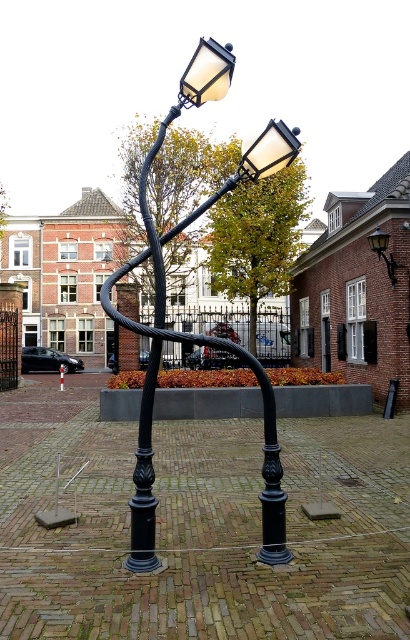
Question: Does black matte lamp post at center appear on the right side of matte black lamp at upper right?

Choices:
 (A) no
 (B) yes

Answer: (A)

Question: Can you confirm if matte glass streetlight at upper center is smaller than matte black lamp at upper right?

Choices:
 (A) no
 (B) yes

Answer: (A)

Question: Which object appears farthest from the camera in this image?

Choices:
 (A) matte glass streetlight at upper center
 (B) matte black lamp at upper right
 (C) black matte lamp post at center
 (D) matte black streetlight at upper center

Answer: (B)

Question: Which object appears farthest from the camera in this image?

Choices:
 (A) matte glass streetlight at upper center
 (B) matte black streetlight at upper center
 (C) black matte lamp post at center
 (D) matte black lamp at upper right

Answer: (D)

Question: Among these points, which one is nearest to the camera?

Choices:
 (A) (375, 243)
 (B) (273, 166)
 (C) (107, 280)
 (D) (218, 61)

Answer: (D)

Question: From the image, what is the correct spatial relationship of black matte lamp post at center in relation to matte black lamp at upper right?

Choices:
 (A) below
 (B) above

Answer: (B)